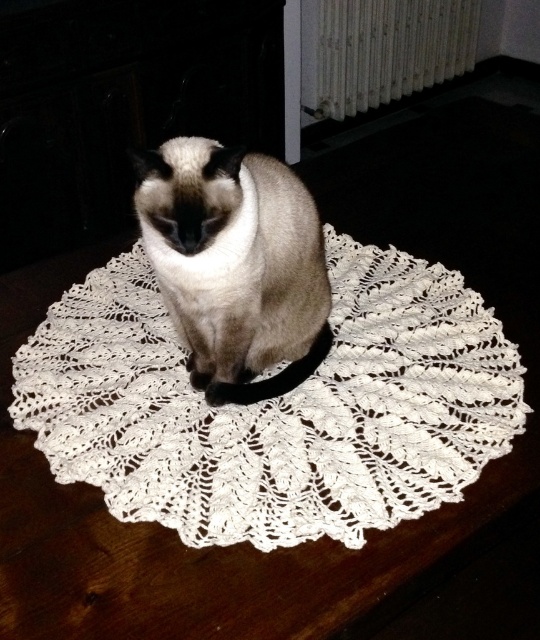
Based on the scene description, where is the silky fur cat at center located in terms of coordinates?

The silky fur cat at center is located at coordinates point (234,264).

You are standing in a room and see the white lace doily at center and the white textured radiator at upper center. Which object is positioned to the left of the other?

The white lace doily at center is to the left of the white textured radiator at upper center.